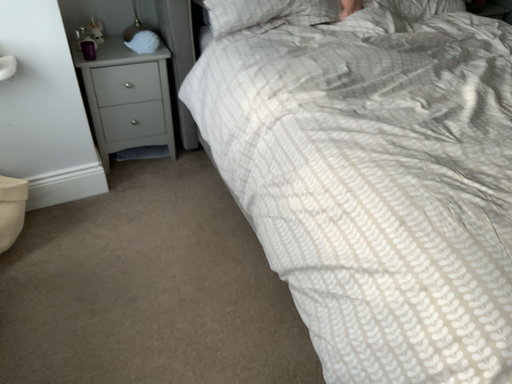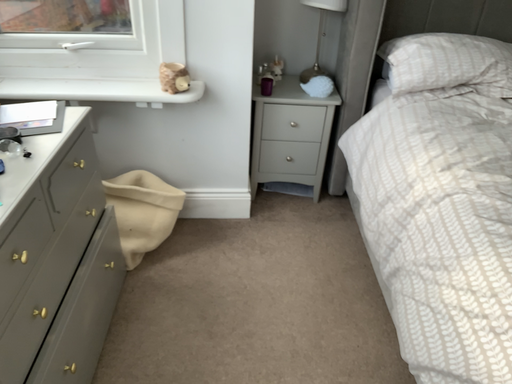
Question: Which way did the camera rotate in the video?

Choices:
 (A) rotated right
 (B) rotated left

Answer: (B)